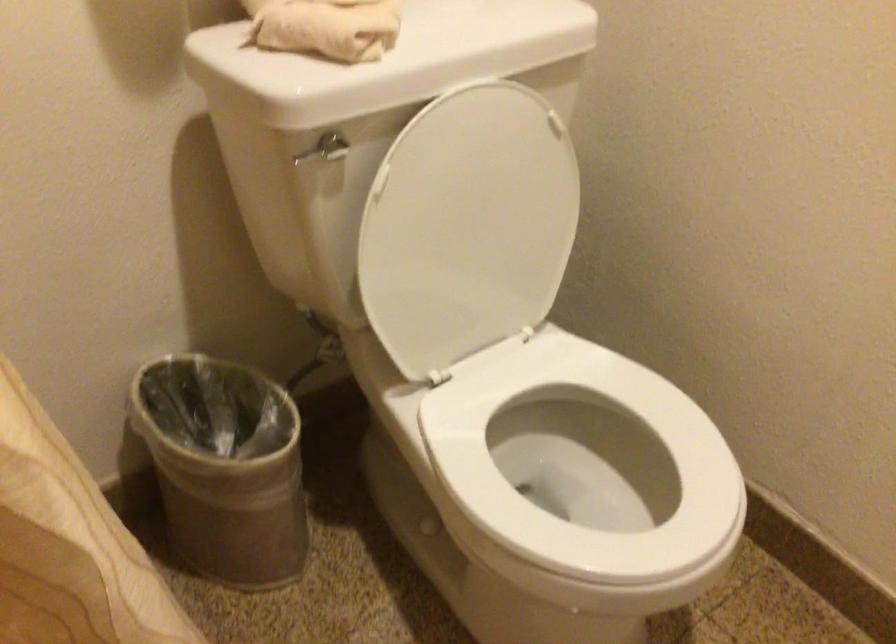
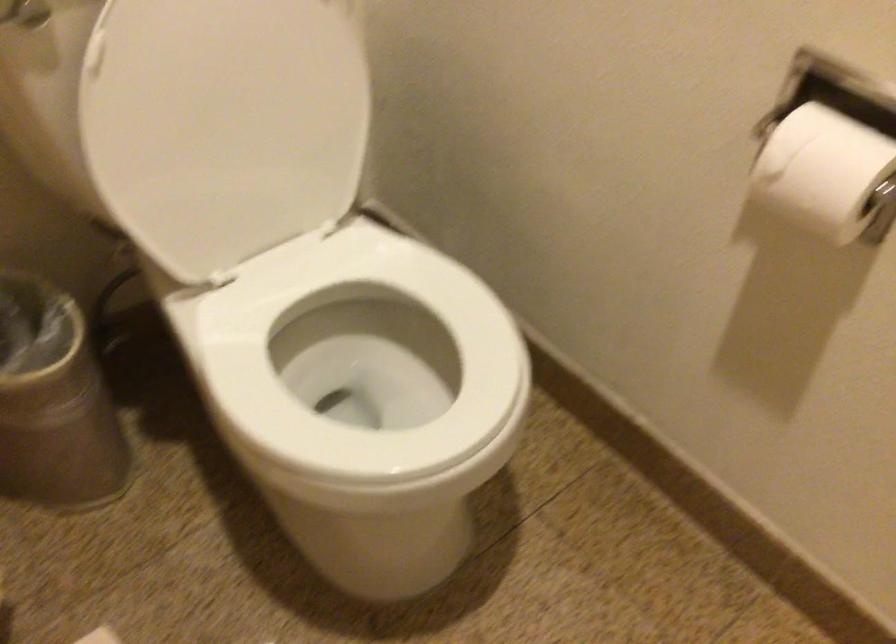
Question: What movement of the cameraman would produce the second image?

Choices:
 (A) Left
 (B) Right
 (C) Forward
 (D) Backward

Answer: (B)